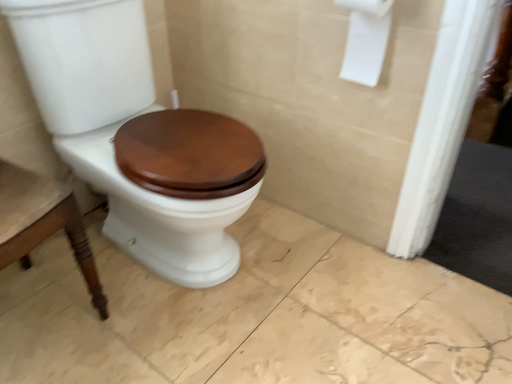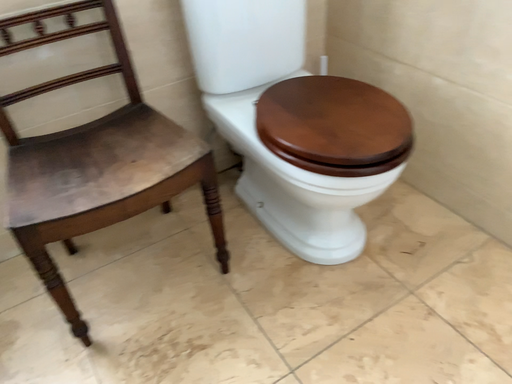
Question: How did the camera likely rotate when shooting the video?

Choices:
 (A) rotated left
 (B) rotated right

Answer: (A)